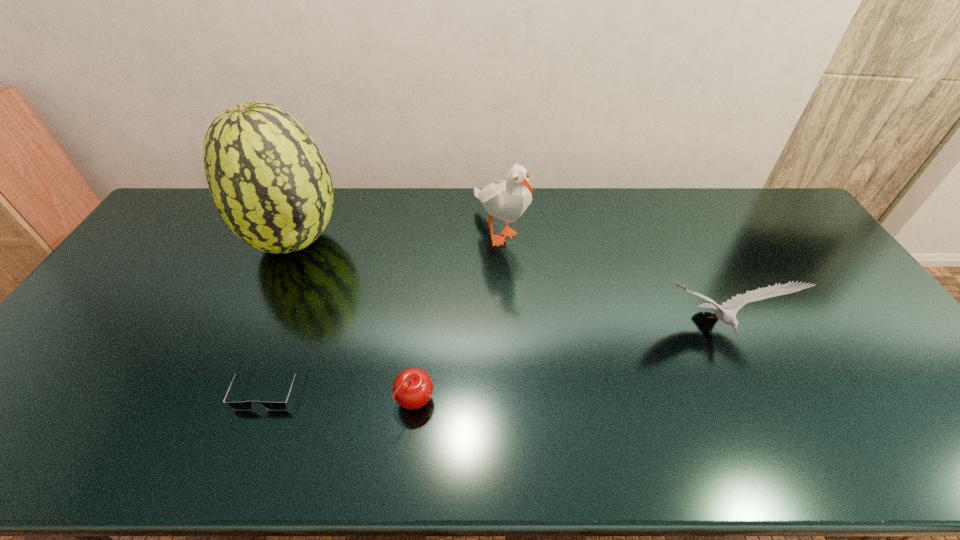
At what (x,y) coordinates should I click in order to perform the action: click on object that is the fourth nearest to the cherry. Please return your answer as a coordinate pair (x, y). The image size is (960, 540). Looking at the image, I should click on (728, 316).

At what (x,y) coordinates should I click in order to perform the action: click on vacant area in the image that satisfies the following two spatial constraints: 1. on the front-facing side of the shortest object; 2. on the left side of the third object from right to left. Please return your answer as a coordinate pair (x, y). Image resolution: width=960 pixels, height=540 pixels. Looking at the image, I should click on (263, 402).

Locate an element on the screen. vacant space that satisfies the following two spatial constraints: 1. on the front side of the tallest object; 2. on the right side of the cherry is located at coordinates (225, 402).